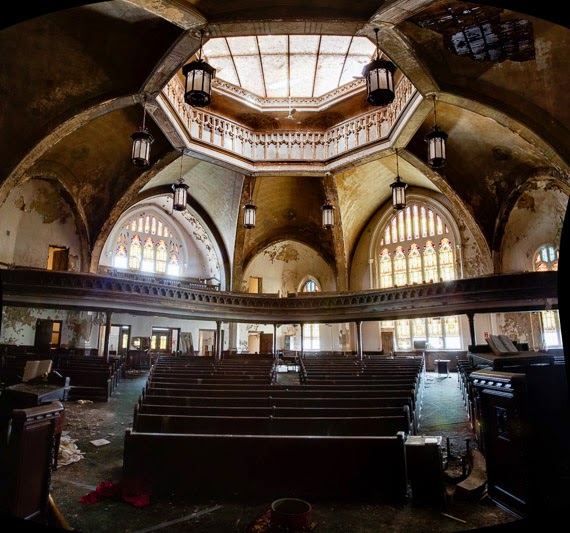
Where is `pews`? pews is located at coordinates (x=211, y=395).